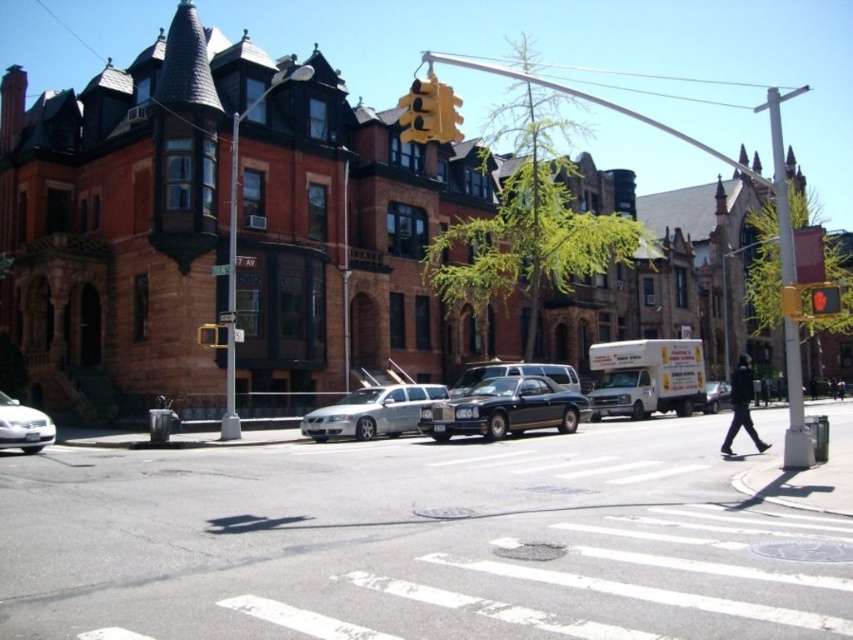
Is yellow matte traffic light at upper center smaller than yellow metallic traffic light at upper center?

Actually, yellow matte traffic light at upper center might be larger than yellow metallic traffic light at upper center.

Between yellow matte traffic light at upper center and yellow metallic traffic light at upper center, which one has more height?

With more height is yellow matte traffic light at upper center.

Is point (405, 100) positioned in front of point (444, 90)?

That is False.

Locate an element on the screen. Image resolution: width=853 pixels, height=640 pixels. yellow matte traffic light at upper center is located at coordinates (421, 112).

Can you confirm if yellow matte traffic light at upper center is thinner than silver metallic sedan at lower left?

No, yellow matte traffic light at upper center is not thinner than silver metallic sedan at lower left.

Can you confirm if yellow matte traffic light at upper center is taller than silver metallic sedan at lower left?

Indeed, yellow matte traffic light at upper center has a greater height compared to silver metallic sedan at lower left.

Between point (410, 99) and point (10, 417), which one is positioned behind?

The point (10, 417) is behind.

At what (x,y) coordinates should I click in order to perform the action: click on yellow matte traffic light at upper center. Please return your answer as a coordinate pair (x, y). The image size is (853, 640). Looking at the image, I should click on tap(421, 112).

Which is behind, point (18, 435) or point (206, 326)?

Point (206, 326)

Does point (48, 444) come in front of point (196, 333)?

Yes, point (48, 444) is closer to viewer.

At what (x,y) coordinates should I click in order to perform the action: click on silver metallic sedan at lower left. Please return your answer as a coordinate pair (x, y). The width and height of the screenshot is (853, 640). Looking at the image, I should click on (22, 426).